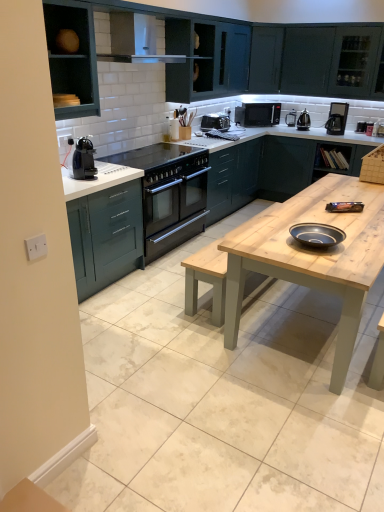
Question: Considering the positions of metallic silver toaster at upper right, the fourth appliance from the left, and light wood table at center in the image, is metallic silver toaster at upper right, the fourth appliance from the left, taller or shorter than light wood table at center?

Choices:
 (A) short
 (B) tall

Answer: (A)

Question: From a real-world perspective, is metallic silver toaster at upper right, the fourth appliance from the left, above or below light wood table at center?

Choices:
 (A) above
 (B) below

Answer: (A)

Question: Considering the real-world distances, which object is farthest from the wooden countertop at right, acting as the third cabinetry starting from the left?

Choices:
 (A) matte blue bowl at center
 (B) metallic silver toaster at upper right, the first appliance when ordered from right to left
 (C) teal matte cabinet at upper left, the 4th cabinetry viewed from the right
 (D) polished stainless steel kettle at upper right, arranged as the second appliance when viewed from the right
 (E) white glossy exhaust hood at upper center

Answer: (C)

Question: Which object is the farthest from the polished stainless steel kettle at upper right, arranged as the second appliance when viewed from the right?

Choices:
 (A) matte teal cabinet at upper center, which is counted as the third cabinetry, starting from the right
 (B) black plastic coffee machine at left
 (C) metallic silver toaster at upper right, the fourth appliance from the left
 (D) satin black toaster at upper center, the 1th appliance positioned from the left
 (E) wooden bookshelf at upper right, acting as the second cabinetry starting from the back

Answer: (B)